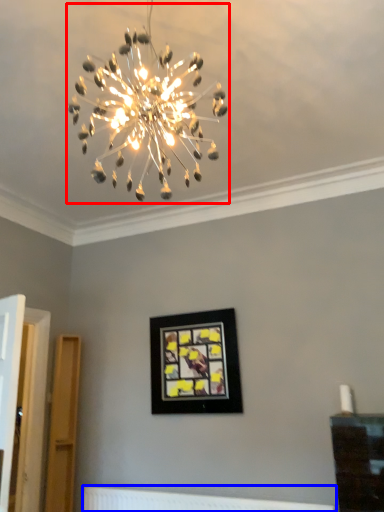
Question: Which object is closer to the camera taking this photo, lamp (highlighted by a red box) or radiator (highlighted by a blue box)?

Choices:
 (A) lamp
 (B) radiator

Answer: (A)